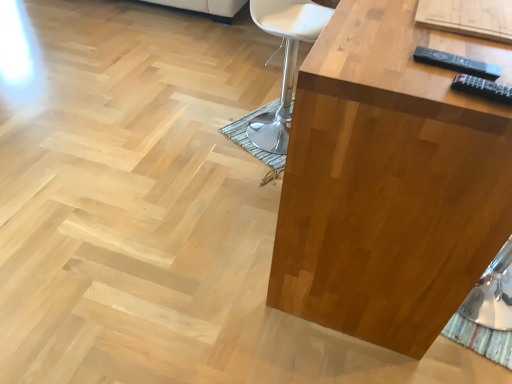
Question: Is white leather chair at center aimed at black plastic remote at upper right, placed as the 1th remote when sorted from front to back?

Choices:
 (A) yes
 (B) no

Answer: (B)

Question: Does white leather chair at center have a lesser width compared to black plastic remote at upper right, placed as the 1th remote when sorted from front to back?

Choices:
 (A) yes
 (B) no

Answer: (B)

Question: Does white leather chair at center have a smaller size compared to black plastic remote at upper right, the 2th remote viewed from the back?

Choices:
 (A) yes
 (B) no

Answer: (B)

Question: Does white leather chair at center have a larger size compared to black plastic remote at upper right, placed as the 1th remote when sorted from front to back?

Choices:
 (A) yes
 (B) no

Answer: (A)

Question: Considering the relative sizes of white leather chair at center and black plastic remote at upper right, the second remote from the top, in the image provided, is white leather chair at center shorter than black plastic remote at upper right, the second remote from the top,?

Choices:
 (A) yes
 (B) no

Answer: (B)

Question: Would you say white leather chair at center is a long distance from black plastic remote at upper right, the 2th remote viewed from the back?

Choices:
 (A) yes
 (B) no

Answer: (A)

Question: Considering the relative positions of satin wood table at right and black plastic remote at upper right, arranged as the first remote when ordered from the bottom, in the image provided, is satin wood table at right to the left of black plastic remote at upper right, arranged as the first remote when ordered from the bottom, from the viewer's perspective?

Choices:
 (A) yes
 (B) no

Answer: (B)

Question: From a real-world perspective, does satin wood table at right stand above black plastic remote at upper right, placed as the 1th remote when sorted from front to back?

Choices:
 (A) yes
 (B) no

Answer: (B)

Question: From the image's perspective, would you say satin wood table at right is positioned over black plastic remote at upper right, arranged as the first remote when ordered from the bottom?

Choices:
 (A) yes
 (B) no

Answer: (A)

Question: Is satin wood table at right next to black plastic remote at upper right, arranged as the first remote when ordered from the bottom?

Choices:
 (A) no
 (B) yes

Answer: (A)

Question: Is satin wood table at right turned away from black plastic remote at upper right, the 2th remote viewed from the back?

Choices:
 (A) yes
 (B) no

Answer: (B)

Question: Is satin wood table at right smaller than black plastic remote at upper right, the 2th remote viewed from the back?

Choices:
 (A) no
 (B) yes

Answer: (A)

Question: From the image's perspective, is black plastic remote at upper right, the 1th remote positioned from the back, on white leather chair at center?

Choices:
 (A) yes
 (B) no

Answer: (B)